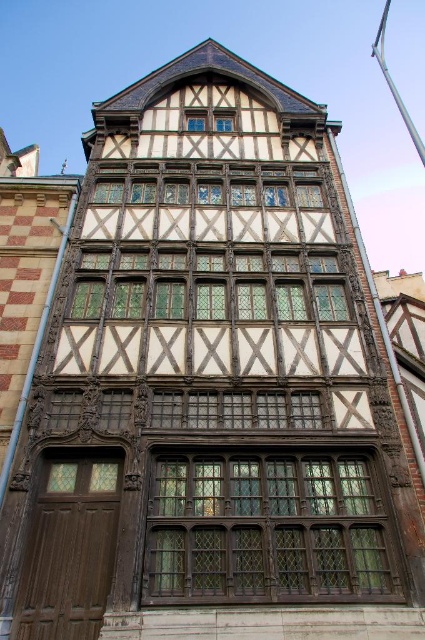
Can you confirm if wooden lattice window at center is bigger than matte wood window at center?

Yes, wooden lattice window at center is bigger than matte wood window at center.

Is wooden lattice window at center wider than matte wood window at center?

Correct, the width of wooden lattice window at center exceeds that of matte wood window at center.

Measure the distance between wooden lattice window at center and camera.

wooden lattice window at center and camera are 32.71 meters apart from each other.

Locate an element on the screen. The height and width of the screenshot is (640, 425). wooden lattice window at center is located at coordinates (266, 529).